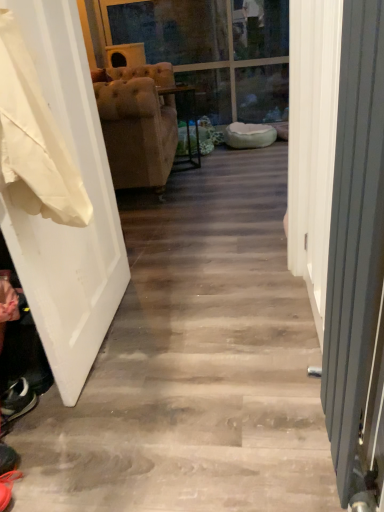
Question: Is white matte door at left to the left of transparent glass door at upper center from the viewer's perspective?

Choices:
 (A) no
 (B) yes

Answer: (B)

Question: Could you tell me if white matte door at left is facing transparent glass door at upper center?

Choices:
 (A) yes
 (B) no

Answer: (B)

Question: Can you confirm if white matte door at left is thinner than transparent glass door at upper center?

Choices:
 (A) yes
 (B) no

Answer: (A)

Question: Is white matte door at left further to camera compared to transparent glass door at upper center?

Choices:
 (A) yes
 (B) no

Answer: (B)

Question: Considering the relative sizes of white matte door at left and transparent glass door at upper center in the image provided, is white matte door at left shorter than transparent glass door at upper center?

Choices:
 (A) yes
 (B) no

Answer: (A)

Question: Is metallic gray radiator at right spatially inside suede-like beige armchair at center, or outside of it?

Choices:
 (A) inside
 (B) outside

Answer: (B)

Question: Looking at the image, does metallic gray radiator at right seem bigger or smaller compared to suede-like beige armchair at center?

Choices:
 (A) small
 (B) big

Answer: (A)

Question: Considering the positions of metallic gray radiator at right and suede-like beige armchair at center in the image, is metallic gray radiator at right wider or thinner than suede-like beige armchair at center?

Choices:
 (A) wide
 (B) thin

Answer: (B)

Question: In the image, is metallic gray radiator at right positioned in front of or behind suede-like beige armchair at center?

Choices:
 (A) behind
 (B) front

Answer: (B)

Question: Would you say suede-like beige armchair at center is inside or outside white matte door at left?

Choices:
 (A) inside
 (B) outside

Answer: (B)

Question: Looking at their shapes, would you say suede-like beige armchair at center is wider or thinner than white matte door at left?

Choices:
 (A) thin
 (B) wide

Answer: (B)

Question: From the image's perspective, is suede-like beige armchair at center positioned above or below white matte door at left?

Choices:
 (A) above
 (B) below

Answer: (A)

Question: Is suede-like beige armchair at center bigger or smaller than white matte door at left?

Choices:
 (A) big
 (B) small

Answer: (A)

Question: Is point [8, 465] positioned closer to the camera than point [360, 126]?

Choices:
 (A) farther
 (B) closer

Answer: (A)

Question: Looking at their shapes, would you say shiny black shoe at lower left is wider or thinner than metallic gray radiator at right?

Choices:
 (A) thin
 (B) wide

Answer: (B)